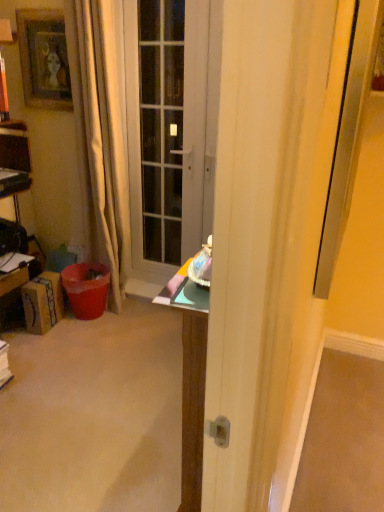
Question: From the image's perspective, relative to wooden framed picture at upper left, is brushed metal drawer at left above or below?

Choices:
 (A) above
 (B) below

Answer: (B)

Question: Is brushed metal drawer at left bigger or smaller than wooden framed picture at upper left?

Choices:
 (A) small
 (B) big

Answer: (A)

Question: Considering the real-world distances, which object is farthest from the wooden framed picture at upper left?

Choices:
 (A) beige fabric curtain at left
 (B) matte gray door at center
 (C) brushed metal drawer at left

Answer: (C)

Question: Estimate the real-world distances between objects in this image. Which object is closer to the matte gray door at center?

Choices:
 (A) wooden framed picture at upper left
 (B) brushed metal drawer at left
 (C) beige fabric curtain at left

Answer: (C)